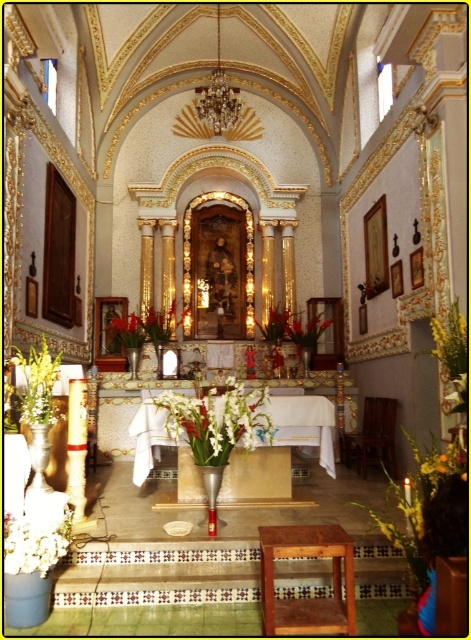
You are attending a religious ceremony in the church and need to place a small bouquet of flowers on the altar. You have a brown wooden stool at lower center and a green leafy plant at left. Which object should you use to reach the altar area?

The brown wooden stool at lower center is in front of the green leafy plant at left, so you should use the brown wooden stool at lower center to reach the altar area since it is closer to you.

In the scene shown: You are standing in the church and want to move from the point at coordinates (48, 556) to the point at (260, 588). Considering the layout of the church, will you have to walk around any obstacles or can you move directly in a straight line?

Since point (260, 588) is behind point (48, 556), you will have to walk around obstacles to reach it as moving in a straight line would not be possible.

You are standing at the entrance of the church and want to place a bouquet of flowers in the metallic vase at center. To do so, in which direction should you walk relative to your current position?

The metallic vase at center is located at coordinates 0.684 on the x axis and 0.312 on the y axis, so you should walk forward and slightly to the right to reach it.